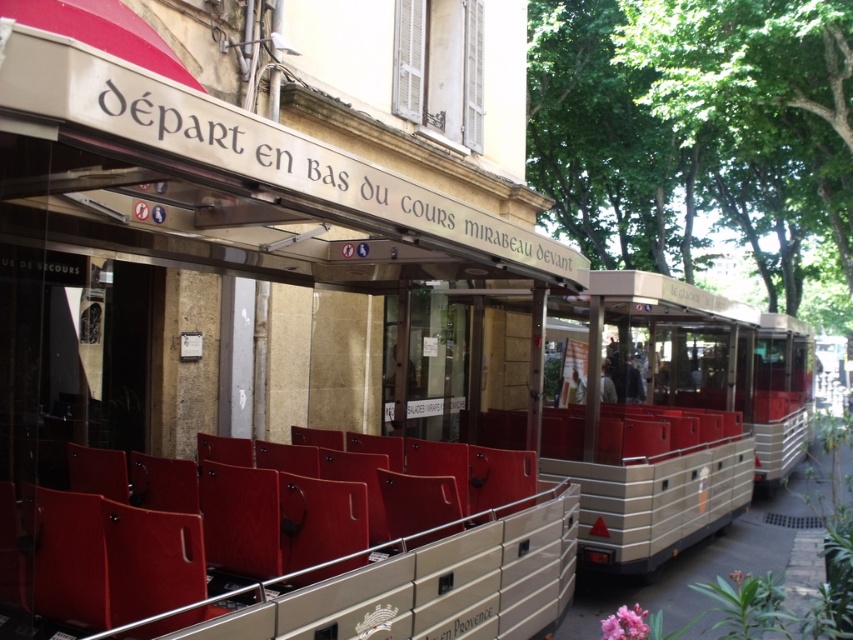
Question: Which point is closer to the camera taking this photo?

Choices:
 (A) (614, 371)
 (B) (451, 486)

Answer: (B)

Question: Can you confirm if matte red chair at center is thinner than metallic silver coach at center?

Choices:
 (A) yes
 (B) no

Answer: (A)

Question: Among these points, which one is nearest to the camera?

Choices:
 (A) (396, 515)
 (B) (628, 396)

Answer: (A)

Question: Is matte red chair at center wider than metallic silver coach at center?

Choices:
 (A) yes
 (B) no

Answer: (B)

Question: Is the position of matte red chair at center more distant than that of metallic silver coach at center?

Choices:
 (A) yes
 (B) no

Answer: (B)